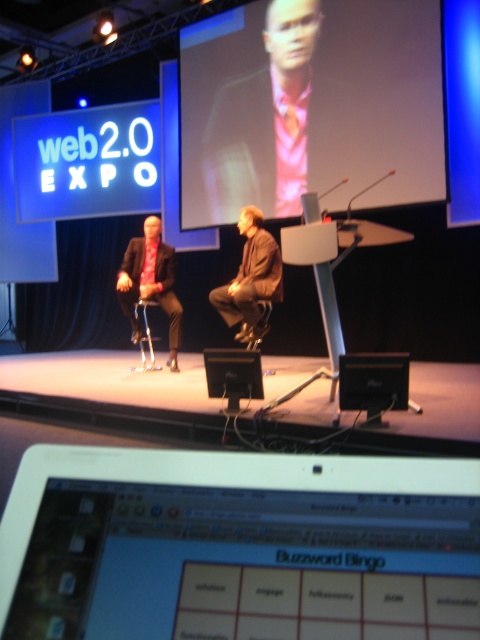
Is matte black suit at left thinner than black leather speaker at center?

No, matte black suit at left is not thinner than black leather speaker at center.

Which of these two, matte black suit at left or black leather speaker at center, stands taller?

Standing taller between the two is matte black suit at left.

Which is in front, point (133, 294) or point (216, 385)?

Positioned in front is point (216, 385).

The image size is (480, 640). Identify the location of matte black suit at left. (151, 282).

Can you confirm if pink fabric at upper center is positioned below matte black suit at left?

No.

Does pink fabric at upper center have a lesser height compared to matte black suit at left?

No.

Is point (384, 35) positioned in front of point (133, 268)?

Yes, it is in front of point (133, 268).

Locate an element on the screen. pink fabric at upper center is located at coordinates (310, 106).

Which is above, pink fabric at upper center or black leather speaker at center?

pink fabric at upper center

Does pink fabric at upper center appear on the right side of black leather speaker at center?

Yes, pink fabric at upper center is to the right of black leather speaker at center.

Who is more forward, (386, 74) or (231, 378)?

Point (231, 378)

This screenshot has height=640, width=480. Identify the location of pink fabric at upper center. (310, 106).